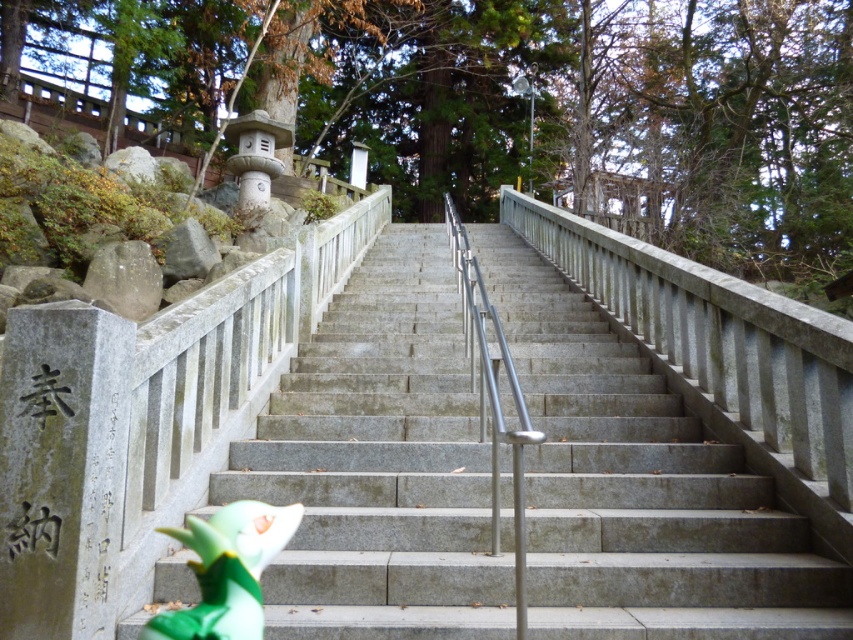
You are a delivery person carrying a package that is the same size as the green plastic toy at lower left. You need to place the package on the gray stone stairs at center. Is the package too big to fit on the stairs?

The gray stone stairs at center is larger in size than green plastic toy at lower left, so the package is not too big to fit on the stairs.

You are a delivery person carrying a large package and need to navigate the gray stone stairs at center. The package is 6 feet long. Can you safely carry it up the stairs without it getting stuck?

The gray stone stairs at center are 6.36 feet apart, so the 6 feet long package will fit safely as it is shorter than the available space between the stairs.